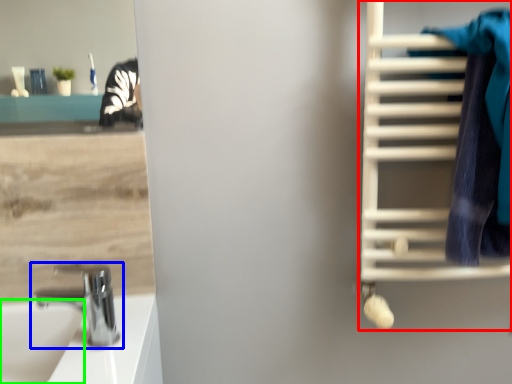
Question: Estimate the real-world distances between objects in this image. Which object is farther from bunk bed (highlighted by a red box), tap (highlighted by a blue box) or sink (highlighted by a green box)?

Choices:
 (A) tap
 (B) sink

Answer: (B)